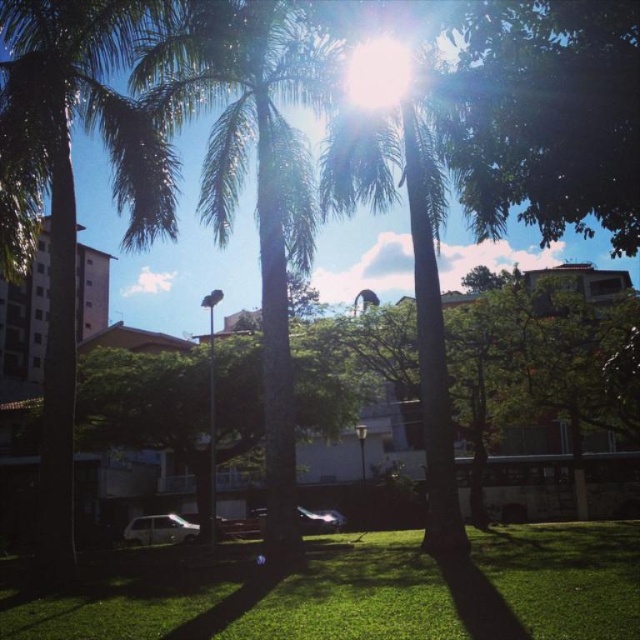
Question: Does green leafy palm tree at left appear over green leafy palm tree at center?

Choices:
 (A) no
 (B) yes

Answer: (A)

Question: Which of the following is the farthest from the observer?

Choices:
 (A) (266, 100)
 (B) (64, 554)
 (C) (428, 595)

Answer: (A)

Question: Which object is positioned closest to the green leafy palm tree at left?

Choices:
 (A) green leafy palm tree at center
 (B) green grass at lower center

Answer: (A)

Question: Does green leafy palm tree at left have a lesser width compared to green leafy palm tree at center?

Choices:
 (A) no
 (B) yes

Answer: (A)

Question: Is green grass at lower center positioned at the back of green leafy palm tree at center?

Choices:
 (A) yes
 (B) no

Answer: (B)

Question: Which object is farther from the camera taking this photo?

Choices:
 (A) green grass at lower center
 (B) green leafy palm tree at center

Answer: (B)